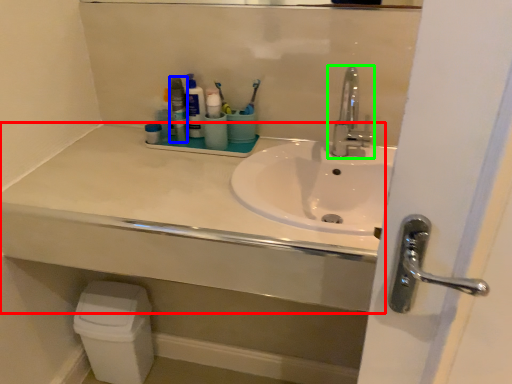
Question: Estimate the real-world distances between objects in this image. Which object is closer to counter top (highlighted by a red box), mouthwash (highlighted by a blue box) or tap (highlighted by a green box)?

Choices:
 (A) mouthwash
 (B) tap

Answer: (A)